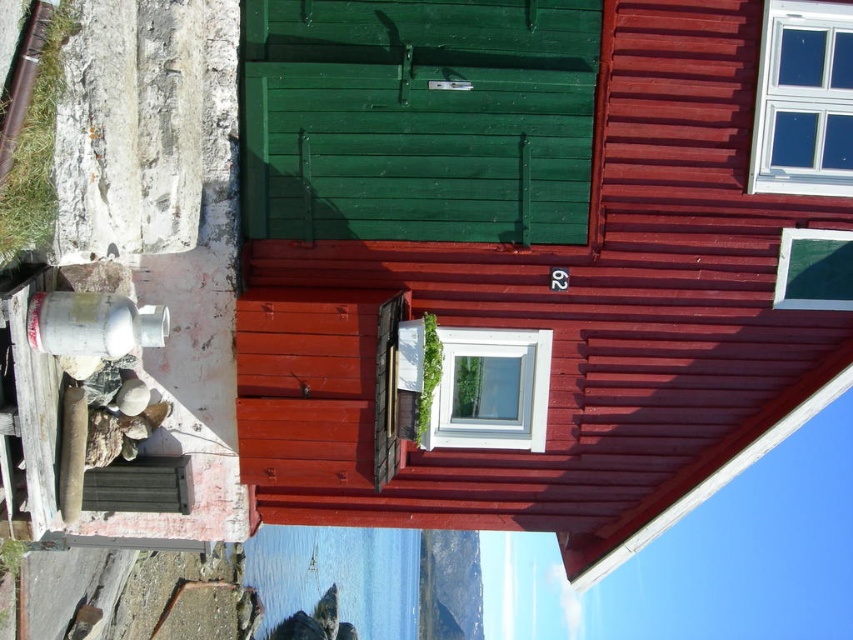
Question: Can you confirm if green wooden door at center is positioned above white plastic window at center?

Choices:
 (A) yes
 (B) no

Answer: (A)

Question: Among these points, which one is nearest to the camera?

Choices:
 (A) (842, 36)
 (B) (515, 420)
 (C) (781, 260)

Answer: (A)

Question: In this image, where is white plastic window at center located relative to green matte window at upper center?

Choices:
 (A) left
 (B) right

Answer: (A)

Question: Which of the following is the closest to the observer?

Choices:
 (A) green matte window at upper center
 (B) green wooden door at center

Answer: (B)

Question: Is clear glass window at upper right above white plastic window at center?

Choices:
 (A) yes
 (B) no

Answer: (A)

Question: Based on their relative distances, which object is farther from the clear glass window at upper right?

Choices:
 (A) green wooden door at center
 (B) green matte window at upper center

Answer: (A)